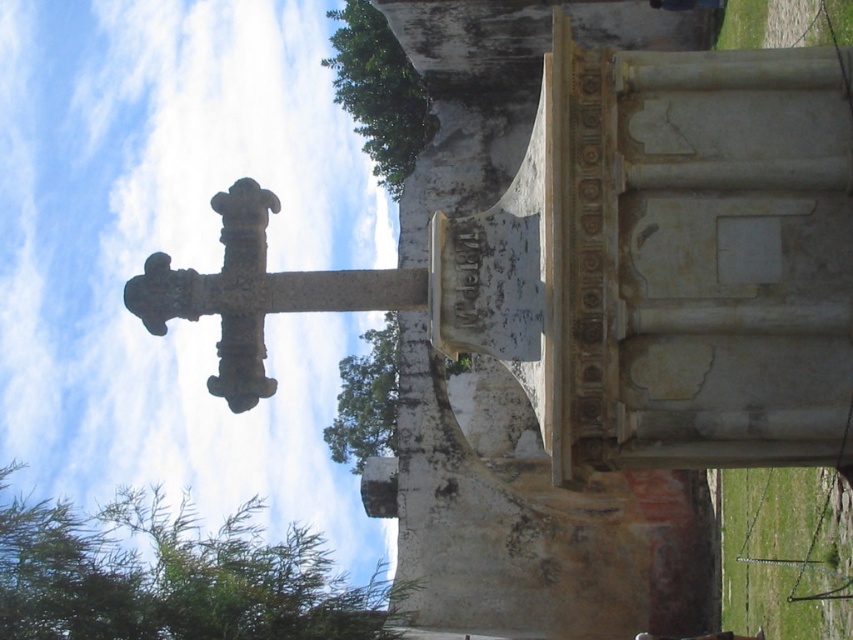
Question: Where is green leafy tree at lower left located in relation to carved stone cross at center in the image?

Choices:
 (A) left
 (B) right

Answer: (A)

Question: Estimate the real-world distances between objects in this image. Which object is closer to the green leafy tree at lower left?

Choices:
 (A) carved stone cross at center
 (B) green leafy tree at upper center

Answer: (B)

Question: Which object appears closest to the camera in this image?

Choices:
 (A) green leafy tree at lower left
 (B) green leafy tree at center
 (C) green leafy tree at upper center
 (D) carved stone cross at center

Answer: (D)

Question: Is green leafy tree at lower left to the right of green leafy tree at upper center from the viewer's perspective?

Choices:
 (A) no
 (B) yes

Answer: (A)

Question: Which object appears closest to the camera in this image?

Choices:
 (A) green leafy tree at upper center
 (B) carved stone cross at center
 (C) green leafy tree at center

Answer: (B)

Question: Is the position of carved stone cross at center less distant than that of green leafy tree at center?

Choices:
 (A) no
 (B) yes

Answer: (B)